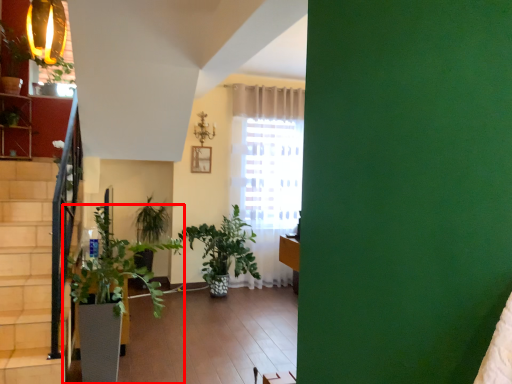
Question: Observing the image, what is the correct spatial positioning of houseplant (annotated by the red box) in reference to flowerpot?

Choices:
 (A) left
 (B) right

Answer: (B)